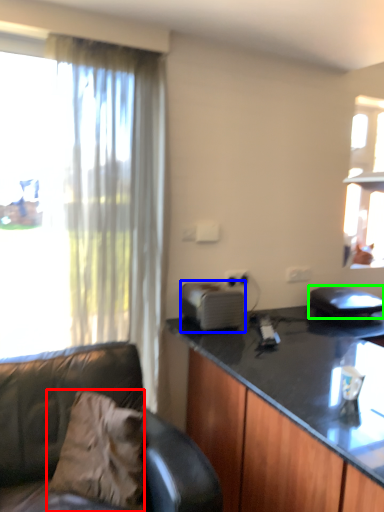
Question: Estimate the real-world distances between objects in this image. Which object is closer to pillow (highlighted by a red box), appliance (highlighted by a blue box) or appliance (highlighted by a green box)?

Choices:
 (A) appliance
 (B) appliance

Answer: (A)